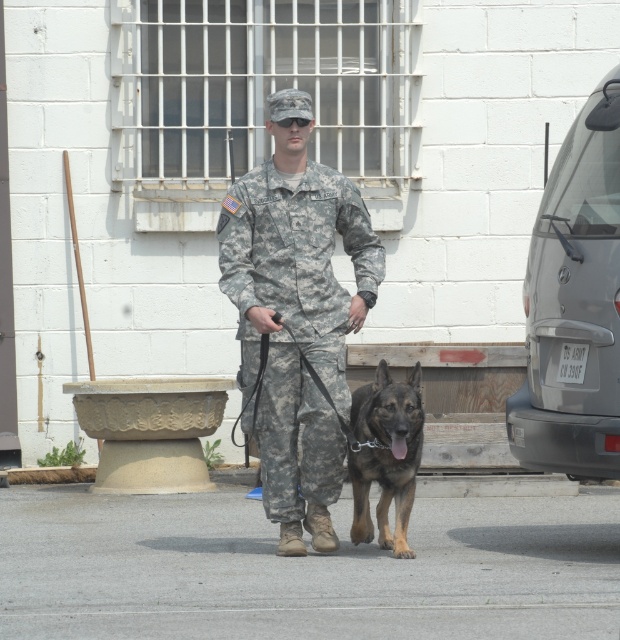
Question: Which point is farther to the camera?

Choices:
 (A) (378, 540)
 (B) (267, 241)

Answer: (A)

Question: Does camouflage uniform at center have a greater width compared to brown fur dog at center?

Choices:
 (A) yes
 (B) no

Answer: (A)

Question: Which object appears farthest from the camera in this image?

Choices:
 (A) camouflage uniform at center
 (B) brown fur dog at center

Answer: (B)

Question: Can you confirm if camouflage uniform at center is thinner than brown fur dog at center?

Choices:
 (A) no
 (B) yes

Answer: (A)

Question: From the image, what is the correct spatial relationship of camouflage uniform at center in relation to brown fur dog at center?

Choices:
 (A) above
 (B) below

Answer: (A)

Question: Which of the following is the closest to the observer?

Choices:
 (A) (275, 212)
 (B) (412, 426)

Answer: (B)